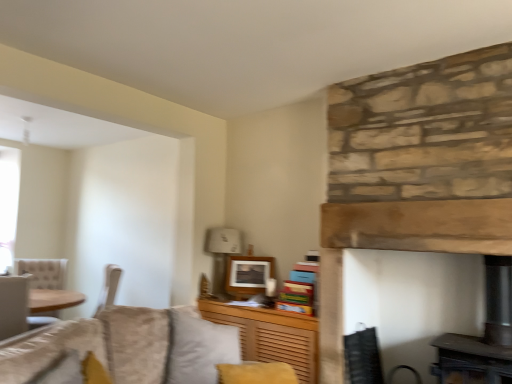
Image resolution: width=512 pixels, height=384 pixels. Find the location of `empty space that is ontop of natural stone fireplace at center (from a real-world perspective)`. empty space that is ontop of natural stone fireplace at center (from a real-world perspective) is located at coordinates (411, 202).